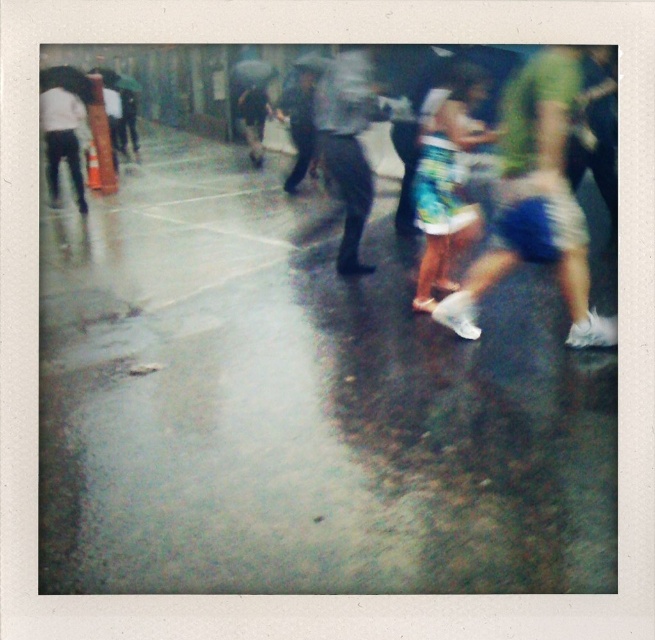
Question: Is blue denim shorts at center bigger than dark gray fabric pants at center?

Choices:
 (A) yes
 (B) no

Answer: (B)

Question: Which object appears closest to the camera in this image?

Choices:
 (A) blue denim shorts at center
 (B) matte black pants at left

Answer: (A)

Question: Is blue printed shorts at center closer to camera compared to dark gray fabric pants at center?

Choices:
 (A) yes
 (B) no

Answer: (A)

Question: Which object is positioned closest to the dark gray fabric umbrella at center?

Choices:
 (A) dark gray fabric pants at center
 (B) matte black pants at left

Answer: (B)

Question: In this image, where is matte black pants at left located relative to dark blue jeans at center?

Choices:
 (A) right
 (B) left

Answer: (B)

Question: Which point appears closest to the camera in this image?

Choices:
 (A) (364, 124)
 (B) (307, 74)
 (C) (610, 550)
 (D) (244, 93)

Answer: (C)